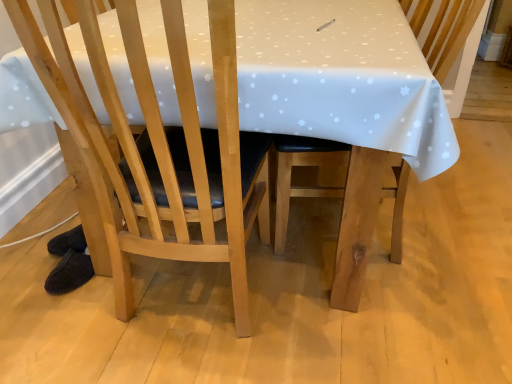
The image size is (512, 384). What are the coordinates of `free space to the left of light wood chair at center, marked as the 1th chair in a left-to-right arrangement` in the screenshot? It's located at tap(51, 316).